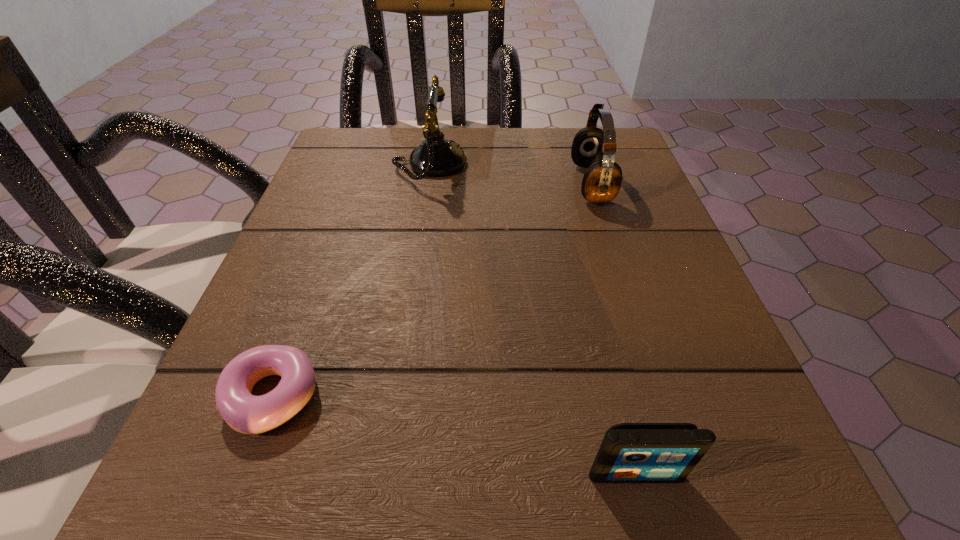
Locate an element on the screen. The image size is (960, 540). vacant area that lies between the headset and the third object from right to left is located at coordinates (511, 174).

I want to click on vacant space that is in between the doughnut and the iPod, so click(454, 435).

Identify the location of empty location between the telephone and the headset. (511, 174).

What are the coordinates of `blank region between the telephone and the headset` in the screenshot? It's located at (511, 174).

You are a GUI agent. You are given a task and a screenshot of the screen. Output one action in this format:
    pyautogui.click(x=<x>, y=<y>)
    Task: Click on the empty space between the shortest object and the nearest object
    Image resolution: width=960 pixels, height=540 pixels.
    Given the screenshot: What is the action you would take?
    pyautogui.click(x=454, y=435)

You are a GUI agent. You are given a task and a screenshot of the screen. Output one action in this format:
    pyautogui.click(x=<x>, y=<y>)
    Task: Click on the free area in between the nearest object and the headset
    This screenshot has height=540, width=960.
    Given the screenshot: What is the action you would take?
    pyautogui.click(x=613, y=328)

This screenshot has height=540, width=960. In order to click on object that is the third closest to the telephone in this screenshot , I will do `click(630, 452)`.

Locate an element on the screen. The height and width of the screenshot is (540, 960). the closest object relative to the doughnut is located at coordinates (630, 452).